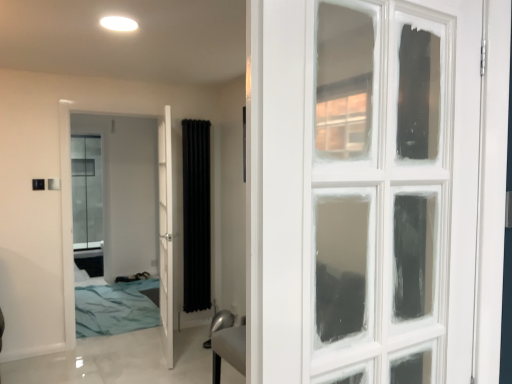
Locate an element on the screen. This screenshot has height=384, width=512. vacant space underneath white glossy door at center, which appears as the 2th door when viewed from the left (from a real-world perspective) is located at coordinates (168, 354).